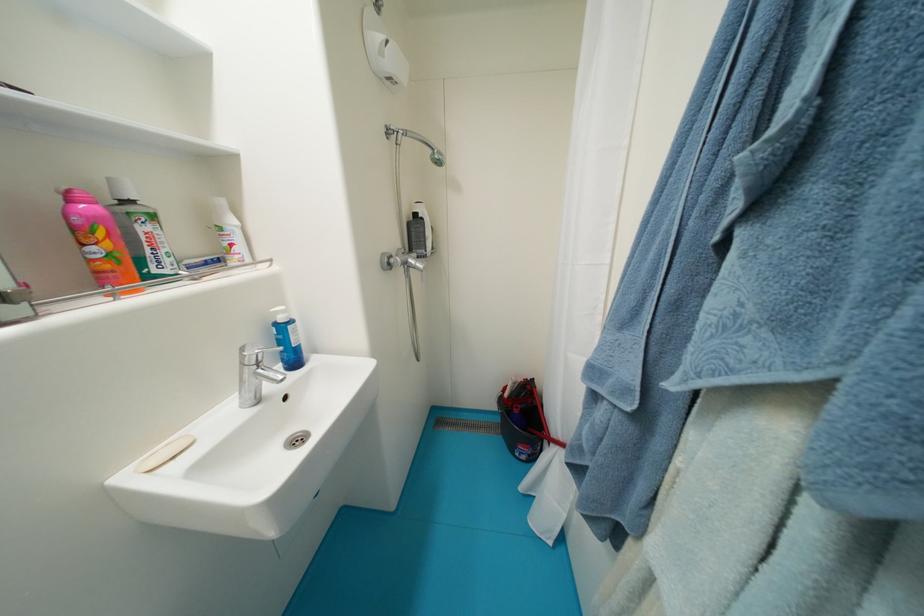
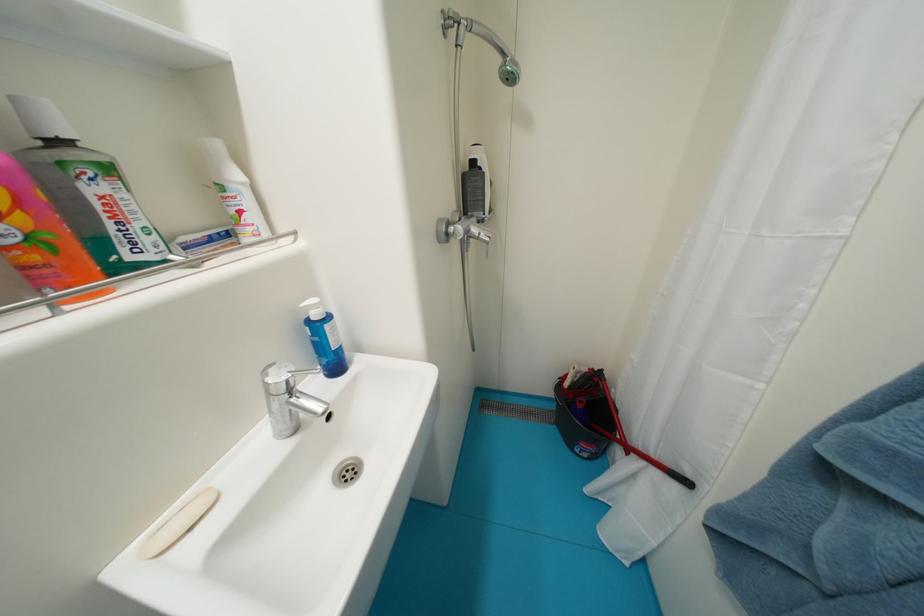
Question: The images are taken continuously from a first-person perspective. In which direction is your viewpoint rotating?

Choices:
 (A) Left
 (B) Right
 (C) Up
 (D) Down

Answer: (D)